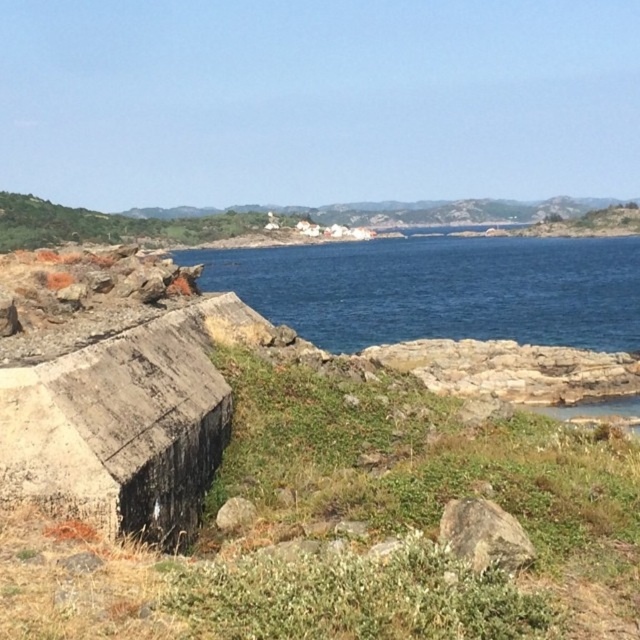
Can you confirm if blue water at center is positioned to the right of brown rough rock at center?

Yes, blue water at center is to the right of brown rough rock at center.

The height and width of the screenshot is (640, 640). Find the location of `blue water at center`. blue water at center is located at coordinates (440, 289).

Identify the location of blue water at center. The width and height of the screenshot is (640, 640). (440, 289).

Locate an element on the screen. blue water at center is located at coordinates (440, 289).

Between brown rough rock at center and gray rough stone at center, which one appears on the left side from the viewer's perspective?

gray rough stone at center

Looking at this image, who is shorter, brown rough rock at center or gray rough stone at center?

gray rough stone at center is shorter.

This screenshot has height=640, width=640. What do you see at coordinates (483, 534) in the screenshot? I see `brown rough rock at center` at bounding box center [483, 534].

Where is `brown rough rock at center`? The image size is (640, 640). brown rough rock at center is located at coordinates (483, 534).

Does blue water at center have a lesser width compared to gray rough stone at center?

In fact, blue water at center might be wider than gray rough stone at center.

Describe the element at coordinates (440, 289) in the screenshot. This screenshot has height=640, width=640. I see `blue water at center` at that location.

Is point (500, 250) farther from viewer compared to point (216, 513)?

That is True.

You are a GUI agent. You are given a task and a screenshot of the screen. Output one action in this format:
    pyautogui.click(x=<x>, y=<y>)
    Task: Click on the blue water at center
    Image resolution: width=640 pixels, height=640 pixels.
    Given the screenshot: What is the action you would take?
    pyautogui.click(x=440, y=289)